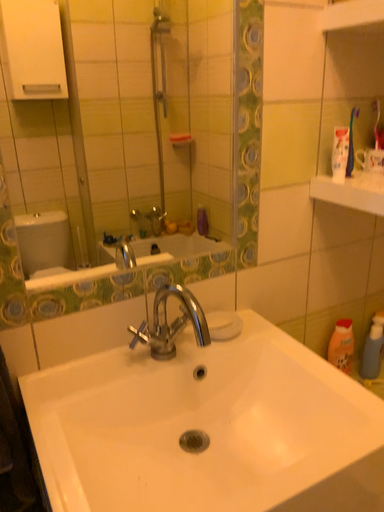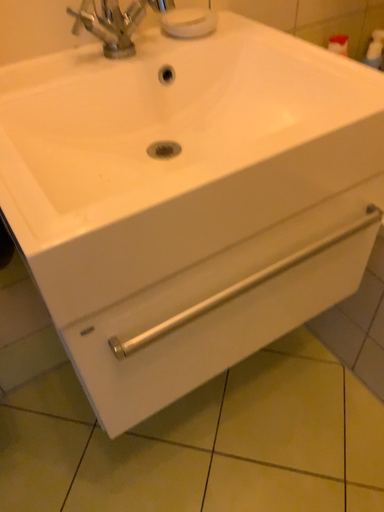
Question: How did the camera likely rotate when shooting the video?

Choices:
 (A) rotated upward
 (B) rotated downward

Answer: (B)